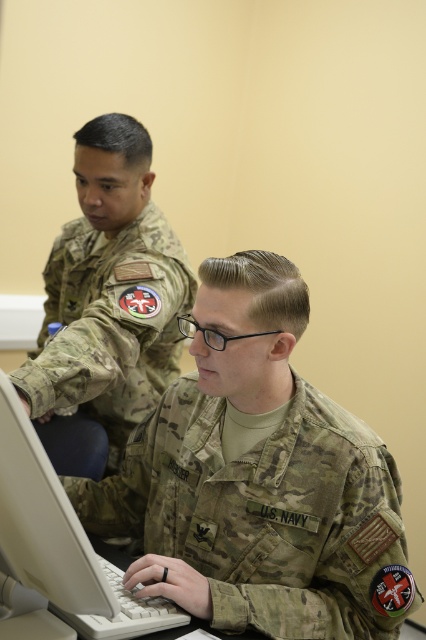
Question: Which is farther from the camouflage fabric us navy uniform at center?

Choices:
 (A) camouflage uniform at center
 (B) white plastic laptop at lower left

Answer: (A)

Question: Does camouflage fabric us navy uniform at center come in front of camouflage uniform at center?

Choices:
 (A) no
 (B) yes

Answer: (B)

Question: Based on their relative distances, which object is farther from the white plastic laptop at lower left?

Choices:
 (A) camouflage fabric us navy uniform at center
 (B) camouflage uniform at center

Answer: (B)

Question: Can you confirm if camouflage fabric us navy uniform at center is bigger than camouflage uniform at center?

Choices:
 (A) yes
 (B) no

Answer: (B)

Question: Which point appears closest to the camera in this image?

Choices:
 (A) tap(313, 536)
 (B) tap(54, 380)
 (C) tap(51, 573)

Answer: (C)

Question: Does camouflage uniform at center appear on the right side of white plastic laptop at lower left?

Choices:
 (A) yes
 (B) no

Answer: (B)